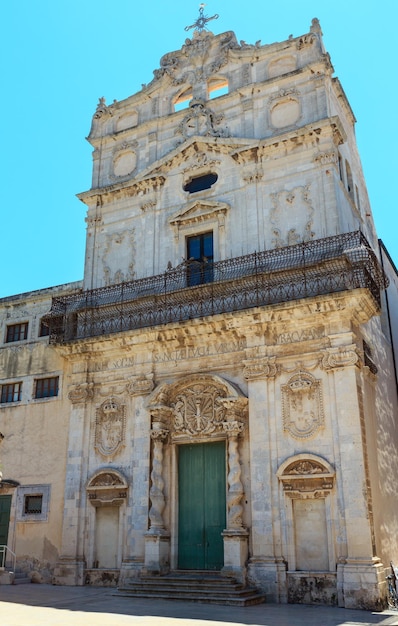
This screenshot has width=398, height=626. I want to click on door, so click(206, 511).